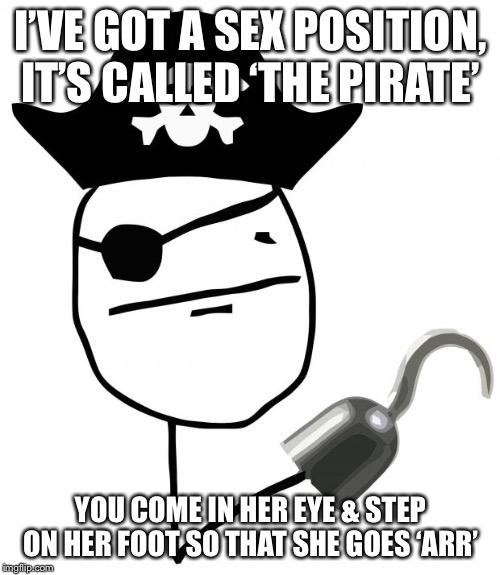
I want to click on hook, so click(411, 367).